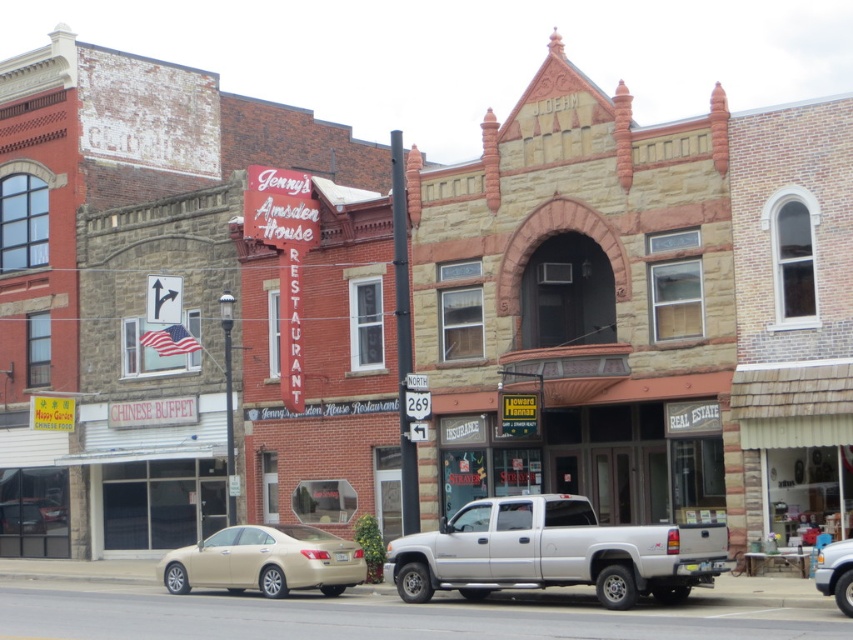
Is silver metallic pickup truck at center bigger than metallic silver truck at center?

Actually, silver metallic pickup truck at center might be smaller than metallic silver truck at center.

Is silver metallic pickup truck at center taller than metallic silver truck at center?

No.

The width and height of the screenshot is (853, 640). What do you see at coordinates (554, 552) in the screenshot?
I see `silver metallic pickup truck at center` at bounding box center [554, 552].

Find the location of a particular element. The image size is (853, 640). silver metallic pickup truck at center is located at coordinates (554, 552).

Does gold metallic sedan at center have a larger size compared to metallic silver truck at center?

No, gold metallic sedan at center is not bigger than metallic silver truck at center.

Does gold metallic sedan at center lie in front of metallic silver truck at center?

No, gold metallic sedan at center is behind metallic silver truck at center.

Is point (282, 573) closer to camera compared to point (827, 580)?

No, it is behind (827, 580).

This screenshot has width=853, height=640. What are the coordinates of `gold metallic sedan at center` in the screenshot? It's located at (265, 561).

Which is below, silver metallic pickup truck at center or gold metallic sedan at center?

Positioned lower is gold metallic sedan at center.

Is silver metallic pickup truck at center closer to the viewer compared to gold metallic sedan at center?

Yes, it is.

Locate an element on the screen. The width and height of the screenshot is (853, 640). silver metallic pickup truck at center is located at coordinates (554, 552).

At what (x,y) coordinates should I click in order to perform the action: click on silver metallic pickup truck at center. Please return your answer as a coordinate pair (x, y). This screenshot has width=853, height=640. Looking at the image, I should click on (554, 552).